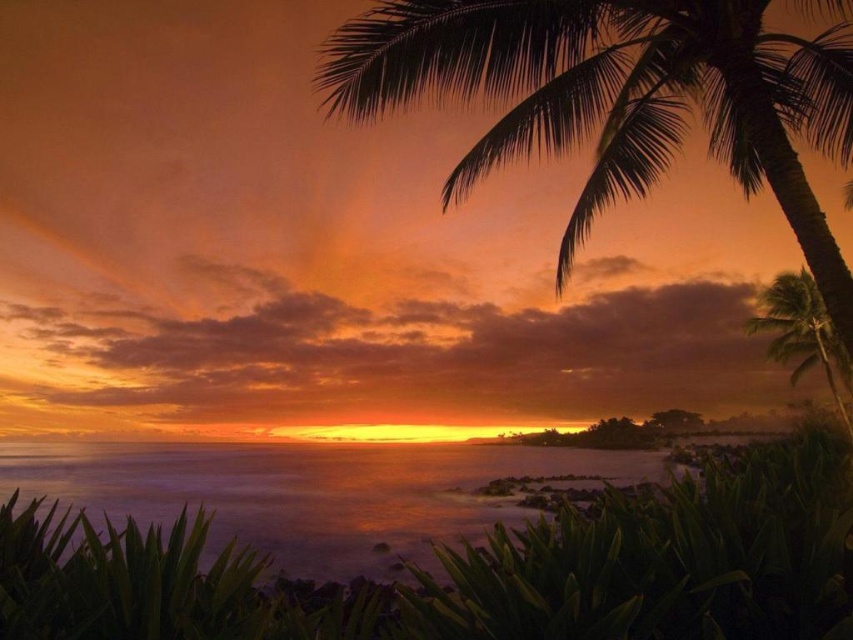
Question: Can you confirm if silhouette leafy palm at upper right is positioned to the right of translucent water at center?

Choices:
 (A) no
 (B) yes

Answer: (A)

Question: Which object is positioned farthest from the silhouette leafy palm at upper right?

Choices:
 (A) green leafy palm tree at right
 (B) translucent water at center

Answer: (A)

Question: Is translucent water at center to the right of green leafy palm tree at right from the viewer's perspective?

Choices:
 (A) no
 (B) yes

Answer: (A)

Question: Which point is closer to the camera?

Choices:
 (A) green leafy palm tree at right
 (B) silhouette leafy palm at upper right

Answer: (B)

Question: Can you confirm if silhouette leafy palm at upper right is positioned above green leafy palm tree at right?

Choices:
 (A) no
 (B) yes

Answer: (B)

Question: Among these objects, which one is nearest to the camera?

Choices:
 (A) green leafy palm tree at right
 (B) silhouette leafy palm at upper right
 (C) translucent water at center

Answer: (B)